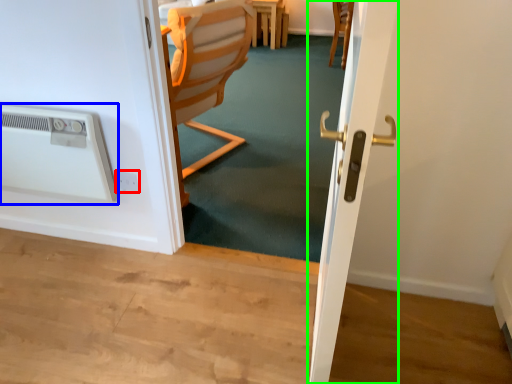
Question: Considering the real-world distances, which object is closest to electric outlet (highlighted by a red box)? air conditioning (highlighted by a blue box) or screen door (highlighted by a green box).

Choices:
 (A) air conditioning
 (B) screen door

Answer: (A)